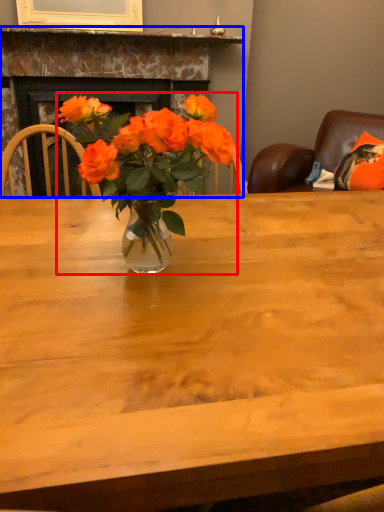
Question: Which object appears farthest to the camera in this image, houseplant (highlighted by a red box) or fireplace (highlighted by a blue box)?

Choices:
 (A) houseplant
 (B) fireplace

Answer: (B)